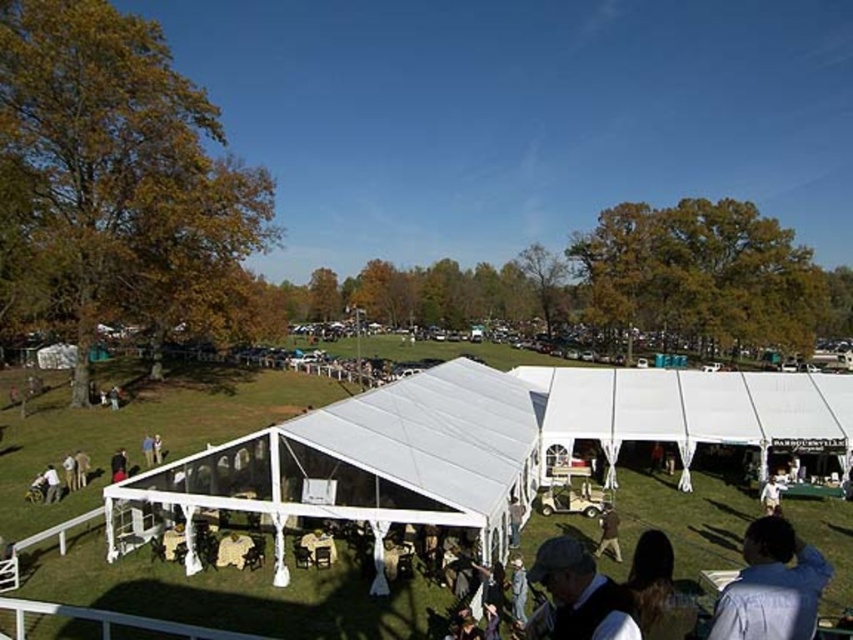
Question: Observing the image, what is the correct spatial positioning of blue shirt at lower right in reference to matte gray hat at lower center?

Choices:
 (A) below
 (B) above

Answer: (A)

Question: Which point appears farthest from the camera in this image?

Choices:
 (A) (512, 525)
 (B) (616, 548)

Answer: (B)

Question: Does matte gray hat at lower center lie behind light brown leather jacket at center?

Choices:
 (A) no
 (B) yes

Answer: (A)

Question: Considering the relative positions of brown leather jacket at lower center and light brown leather jacket at center in the image provided, where is brown leather jacket at lower center located with respect to light brown leather jacket at center?

Choices:
 (A) right
 (B) left

Answer: (A)

Question: Considering the real-world distances, which object is closest to the light brown leather jacket at center?

Choices:
 (A) matte gray hat at lower center
 (B) blue shirt at lower right
 (C) brown leather jacket at lower center

Answer: (C)

Question: Which of the following is the closest to the observer?

Choices:
 (A) (788, 637)
 (B) (618, 516)

Answer: (A)